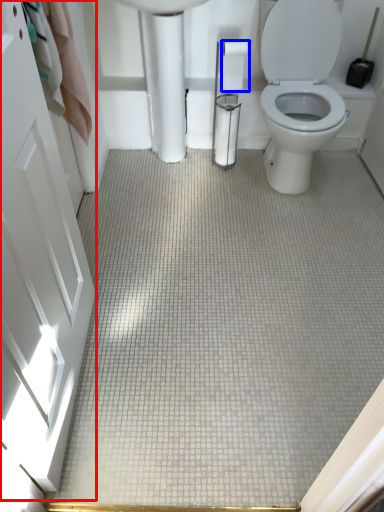
Question: Which of the following is the closest to the observer, screen door (highlighted by a red box) or toilet paper (highlighted by a blue box)?

Choices:
 (A) screen door
 (B) toilet paper

Answer: (A)